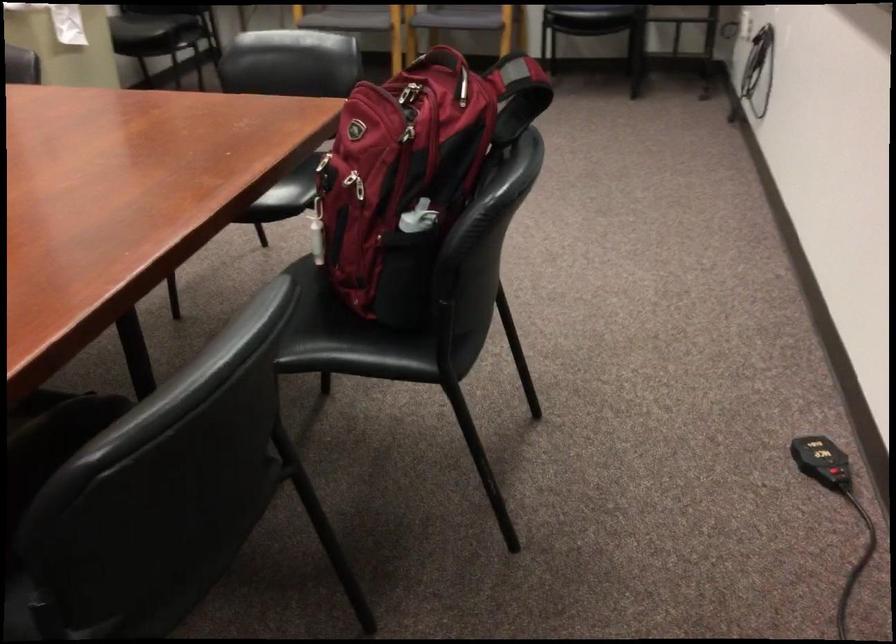
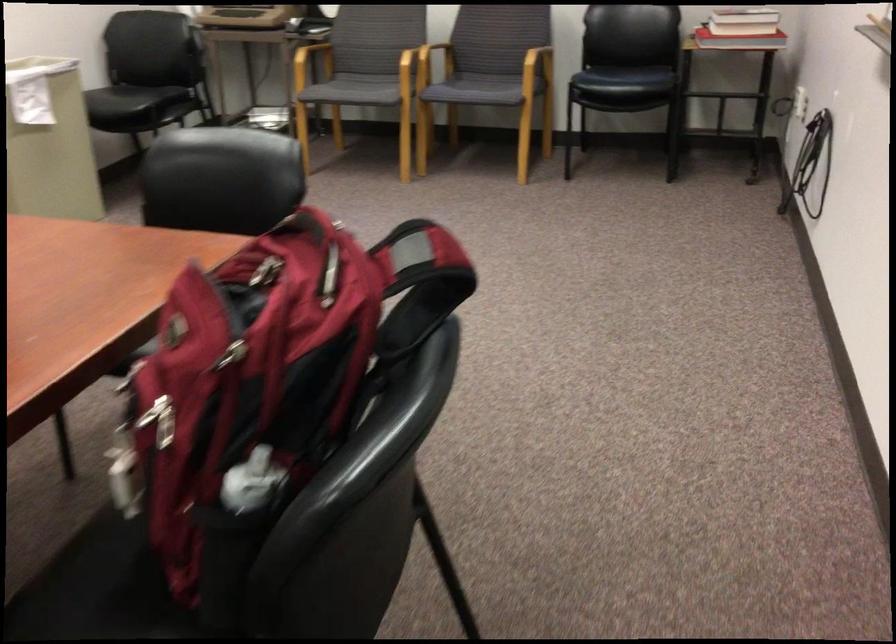
Question: How did the camera likely rotate?

Choices:
 (A) Left
 (B) Right
 (C) Up
 (D) Down

Answer: (A)